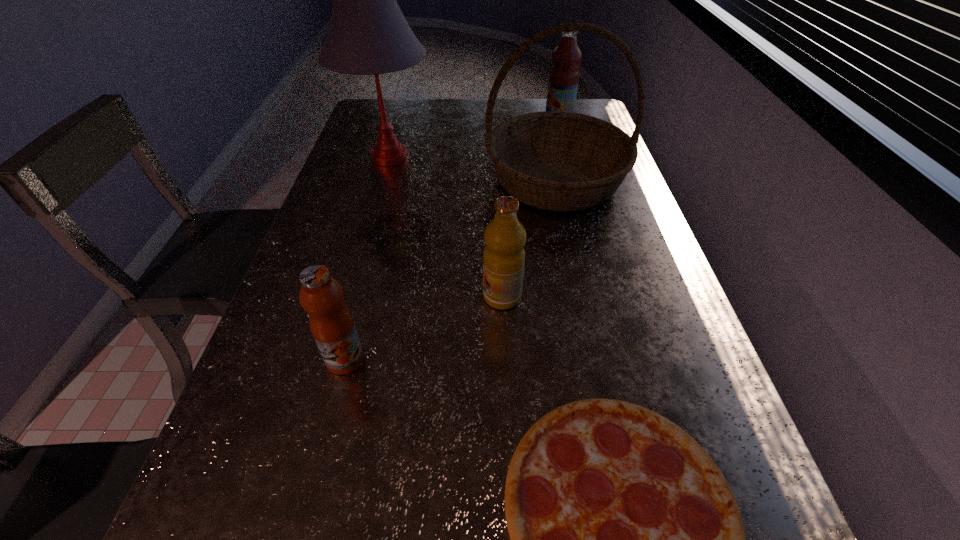
This screenshot has width=960, height=540. Find the location of `table lamp`. table lamp is located at coordinates (368, 34).

This screenshot has height=540, width=960. I want to click on basket, so click(x=559, y=161).

The height and width of the screenshot is (540, 960). What are the coordinates of `the rightmost fruit juice` in the screenshot? It's located at (564, 75).

Where is `the third tallest object`? The width and height of the screenshot is (960, 540). the third tallest object is located at coordinates (564, 75).

The height and width of the screenshot is (540, 960). Identify the location of the second fruit juice from right to left. (504, 256).

Locate an element on the screen. This screenshot has width=960, height=540. the fourth farthest object is located at coordinates (504, 256).

Identify the location of the nearest fruit juice. (331, 323).

Find the location of a particular element. The width and height of the screenshot is (960, 540). the leftmost fruit juice is located at coordinates (331, 323).

The height and width of the screenshot is (540, 960). Identify the location of vacant space situated 0.380m on the front-facing side of the table lamp. (557, 158).

Locate an element on the screen. The width and height of the screenshot is (960, 540). vacant region located on the back of the basket is located at coordinates [546, 137].